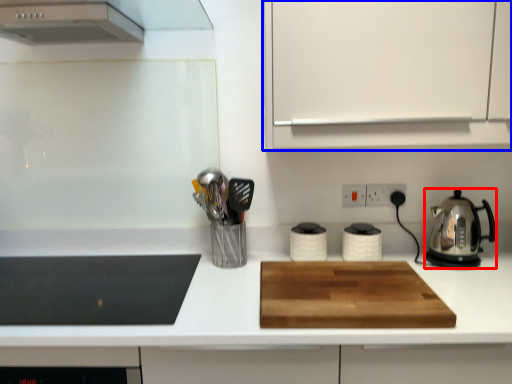
Question: Which point is closer to the camera, kitchen appliance (highlighted by a red box) or cabinetry (highlighted by a blue box)?

Choices:
 (A) kitchen appliance
 (B) cabinetry

Answer: (B)